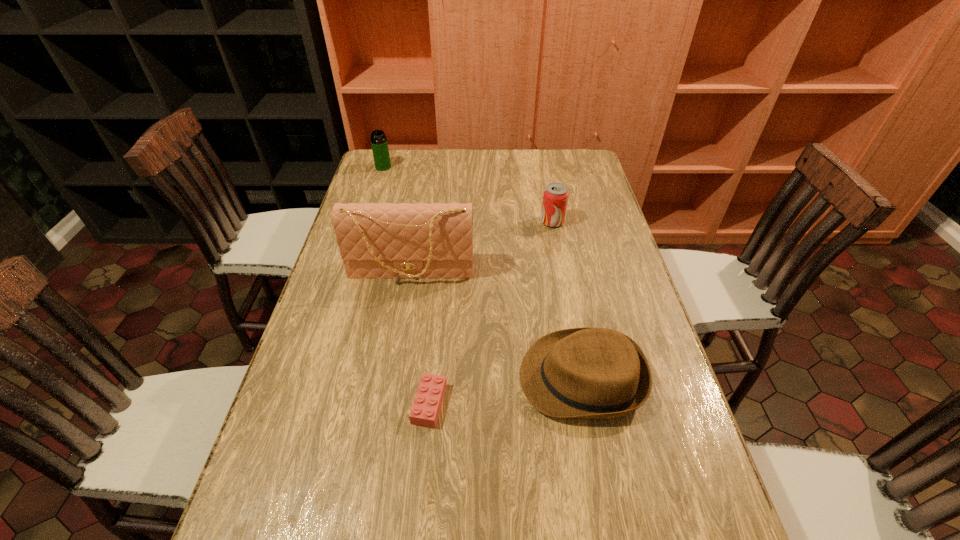
The width and height of the screenshot is (960, 540). In order to click on the third farthest object in this screenshot , I will do (x=376, y=241).

Where is `the tallest object`? The image size is (960, 540). the tallest object is located at coordinates tap(376, 241).

The width and height of the screenshot is (960, 540). In order to click on thermos bottle in this screenshot , I will do `click(379, 144)`.

This screenshot has height=540, width=960. Identify the location of the farthest object. (379, 144).

The image size is (960, 540). In order to click on the third shortest object in this screenshot , I will do `click(555, 197)`.

You are a GUI agent. You are given a task and a screenshot of the screen. Output one action in this format:
    pyautogui.click(x=<x>, y=<y>)
    Task: Click on the soda can
    The image size is (960, 540).
    Given the screenshot: What is the action you would take?
    (555, 197)

You are a GUI agent. You are given a task and a screenshot of the screen. Output one action in this format:
    pyautogui.click(x=<x>, y=<y>)
    Task: Click on the fedora
    
    Given the screenshot: What is the action you would take?
    pyautogui.click(x=601, y=373)

You are a GUI agent. You are given a task and a screenshot of the screen. Output one action in this format:
    pyautogui.click(x=<x>, y=<y>)
    Task: Click on the shortest object
    The image size is (960, 540).
    Given the screenshot: What is the action you would take?
    pyautogui.click(x=425, y=410)

Find the location of `blank space located on the front-facing side of the handbag`. blank space located on the front-facing side of the handbag is located at coordinates (403, 323).

Where is `free region located from the spout of the farthest object`? free region located from the spout of the farthest object is located at coordinates (369, 215).